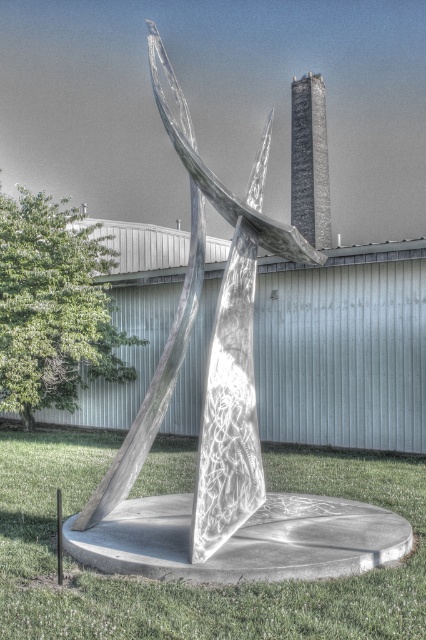
In the scene shown: Does green grass at center have a smaller size compared to shiny metallic sculpture at center?

Yes.

Which is more to the left, green grass at center or shiny metallic sculpture at center?

green grass at center

Between point (391, 566) and point (218, 205), which one is positioned behind?

Positioned behind is point (218, 205).

Find the location of a particular element. The height and width of the screenshot is (640, 426). green grass at center is located at coordinates (196, 586).